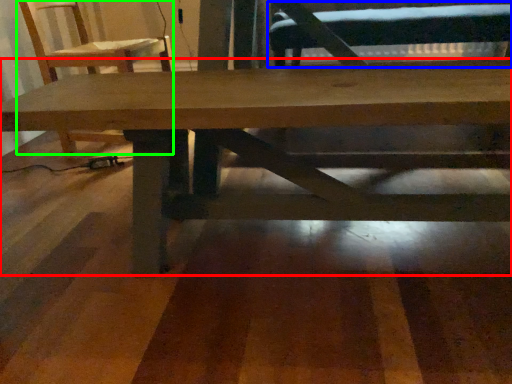
Question: Based on their relative distances, which object is nearer to table (highlighted by a red box)? Choose from swivel chair (highlighted by a blue box) and chair (highlighted by a green box).

Choices:
 (A) swivel chair
 (B) chair

Answer: (B)